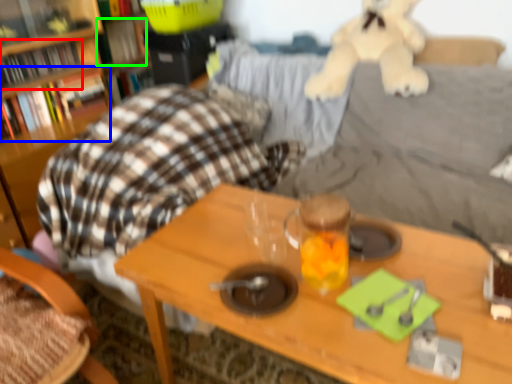
Question: Estimate the real-world distances between objects in this image. Which object is closer to book (highlighted by a red box), book (highlighted by a blue box) or book (highlighted by a green box)?

Choices:
 (A) book
 (B) book

Answer: (A)